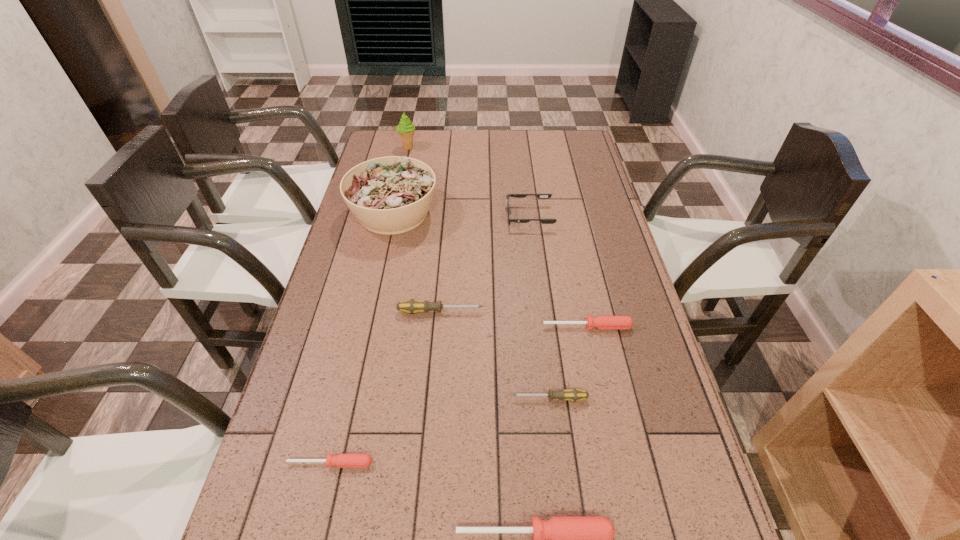
I want to click on green icecream, so click(x=406, y=129).

Image resolution: width=960 pixels, height=540 pixels. What are the coordinates of `icecream` in the screenshot? It's located at (406, 129).

Locate an element on the screen. This screenshot has height=540, width=960. salad is located at coordinates (391, 195).

Identify the location of sunglasses. The width and height of the screenshot is (960, 540). (541, 196).

Locate an element on the screen. The height and width of the screenshot is (540, 960). the fifth nearest object is located at coordinates (412, 306).

Locate an element on the screen. The image size is (960, 540). the left gray screwdriver is located at coordinates (412, 306).

At what (x,y) coordinates should I click in order to perform the action: click on the second smallest red screwdriver. Please return your answer as a coordinate pair (x, y). The width and height of the screenshot is (960, 540). Looking at the image, I should click on (601, 322).

Identify the location of the second farthest screwdriver. (601, 322).

The height and width of the screenshot is (540, 960). What are the coordinates of `the right gray screwdriver` in the screenshot? It's located at (574, 394).

Locate an element on the screen. Image resolution: width=960 pixels, height=540 pixels. the third nearest screwdriver is located at coordinates (574, 394).